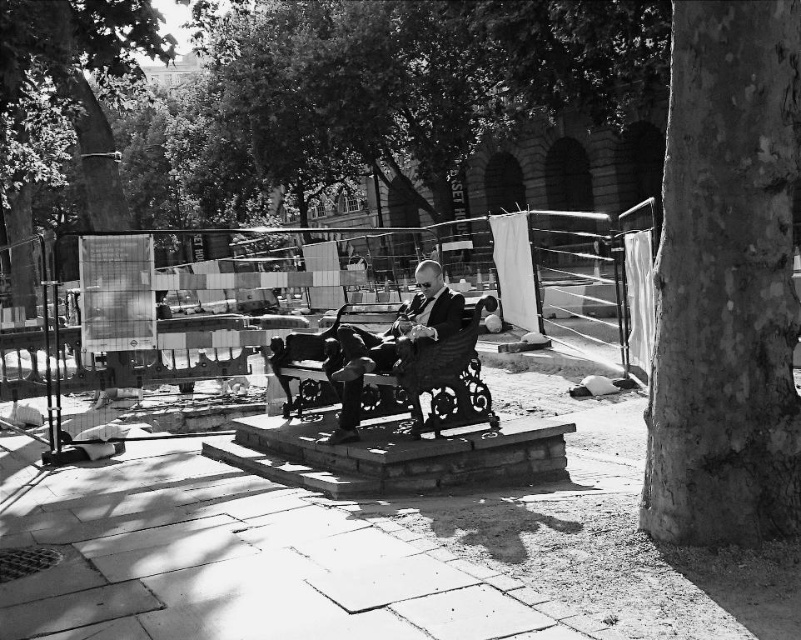
Question: Which point is farther to the camera?

Choices:
 (A) smooth bark tree trunk at right
 (B) smooth black suit at center

Answer: (B)

Question: Can you confirm if smooth bark tree trunk at right is positioned to the left of smooth black suit at center?

Choices:
 (A) no
 (B) yes

Answer: (A)

Question: Can you confirm if smooth bark tree trunk at right is positioned above smooth black suit at center?

Choices:
 (A) no
 (B) yes

Answer: (B)

Question: Can you confirm if smooth bark tree trunk at right is positioned to the right of smooth black suit at center?

Choices:
 (A) no
 (B) yes

Answer: (B)

Question: Which object appears farthest from the camera in this image?

Choices:
 (A) smooth bark tree trunk at right
 (B) smooth black suit at center

Answer: (B)

Question: Which point is farther from the camera taking this photo?

Choices:
 (A) (381, 344)
 (B) (677, 323)

Answer: (A)